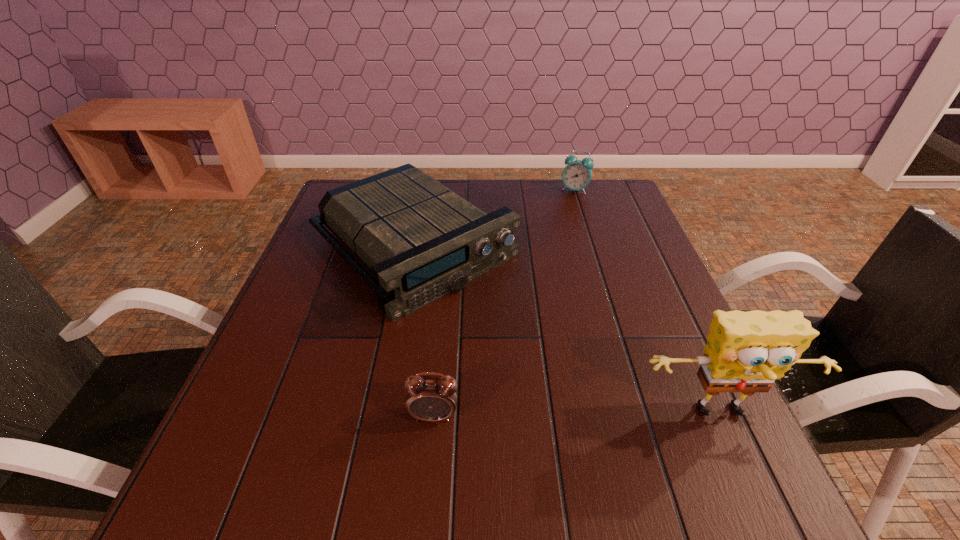
Locate an element on the screen. alarm clock that is at the far edge is located at coordinates (576, 175).

Locate an element on the screen. This screenshot has width=960, height=540. radio receiver that is at the far edge is located at coordinates (420, 240).

I want to click on alarm clock located at the near edge, so click(x=429, y=398).

The width and height of the screenshot is (960, 540). Find the location of `sponge positioned at the near edge`. sponge positioned at the near edge is located at coordinates (746, 352).

At what (x,y) coordinates should I click in order to perform the action: click on object that is at the left edge. Please return your answer as a coordinate pair (x, y). This screenshot has width=960, height=540. Looking at the image, I should click on (420, 240).

Find the location of a particular element. sponge that is positioned at the right edge is located at coordinates (746, 352).

At what (x,y) coordinates should I click in order to perform the action: click on alarm clock located at the right edge. Please return your answer as a coordinate pair (x, y). The width and height of the screenshot is (960, 540). Looking at the image, I should click on click(x=576, y=175).

Where is `object that is at the far left corner`? The width and height of the screenshot is (960, 540). object that is at the far left corner is located at coordinates (420, 240).

This screenshot has height=540, width=960. What are the coordinates of `object positioned at the far right corner` in the screenshot? It's located at (576, 175).

Image resolution: width=960 pixels, height=540 pixels. Find the location of `object that is at the near right corner`. object that is at the near right corner is located at coordinates (746, 352).